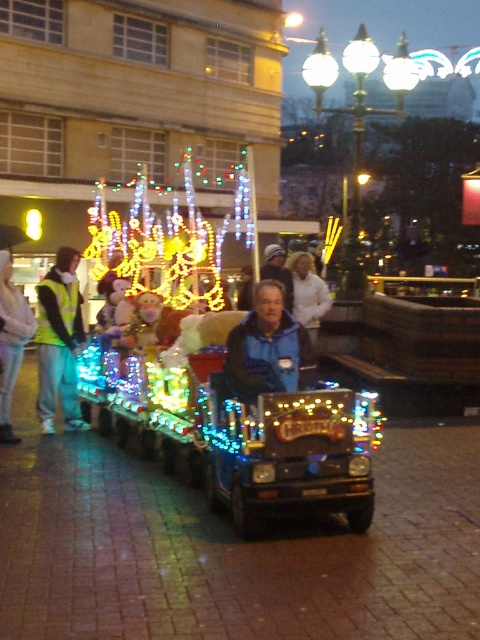
Question: Which object is closer to the camera taking this photo?

Choices:
 (A) light blue denim jacket at center
 (B) blue fabric jacket at center

Answer: (B)

Question: Is blue fleece jacket at center thinner than light blue denim jacket at center?

Choices:
 (A) yes
 (B) no

Answer: (B)

Question: Among these points, which one is farthest from the camera?

Choices:
 (A) (4, 352)
 (B) (292, 292)

Answer: (B)

Question: Based on their relative distances, which object is farther from the blue fleece jacket at center?

Choices:
 (A) blue fabric jacket at center
 (B) high-visibility yellow vest at left

Answer: (B)

Question: Is blue fleece jacket at center positioned in front of high-visibility yellow vest at left?

Choices:
 (A) no
 (B) yes

Answer: (B)

Question: Observing the image, what is the correct spatial positioning of high-visibility yellow vest at left in reference to light blue denim jacket at center?

Choices:
 (A) right
 (B) left

Answer: (B)